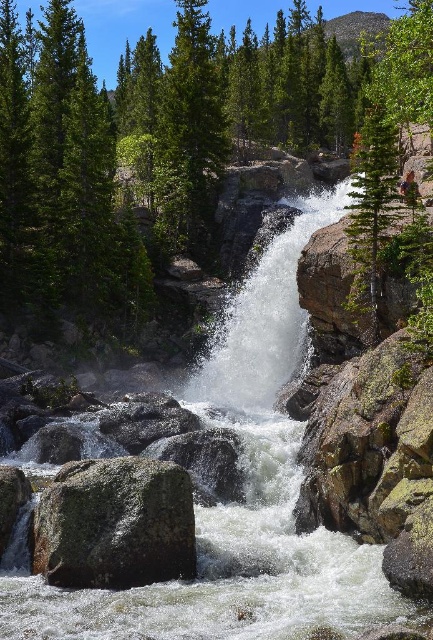
Question: Does green textured tree at center have a smaller size compared to green matte tree at upper right?

Choices:
 (A) no
 (B) yes

Answer: (A)

Question: Which point is farther to the camera?

Choices:
 (A) green matte tree at upper right
 (B) green textured tree at center
 (C) green mossy rock at center

Answer: (A)

Question: Which point is farther from the camera taking this photo?

Choices:
 (A) (122, 572)
 (B) (374, 228)

Answer: (B)

Question: Is green mossy rock at center bigger than green matte tree at upper right?

Choices:
 (A) no
 (B) yes

Answer: (A)

Question: Which point appears closest to the camera in this image?

Choices:
 (A) (377, 108)
 (B) (164, 568)

Answer: (B)

Question: Is green textured tree at center to the right of green mossy rock at center from the viewer's perspective?

Choices:
 (A) yes
 (B) no

Answer: (A)